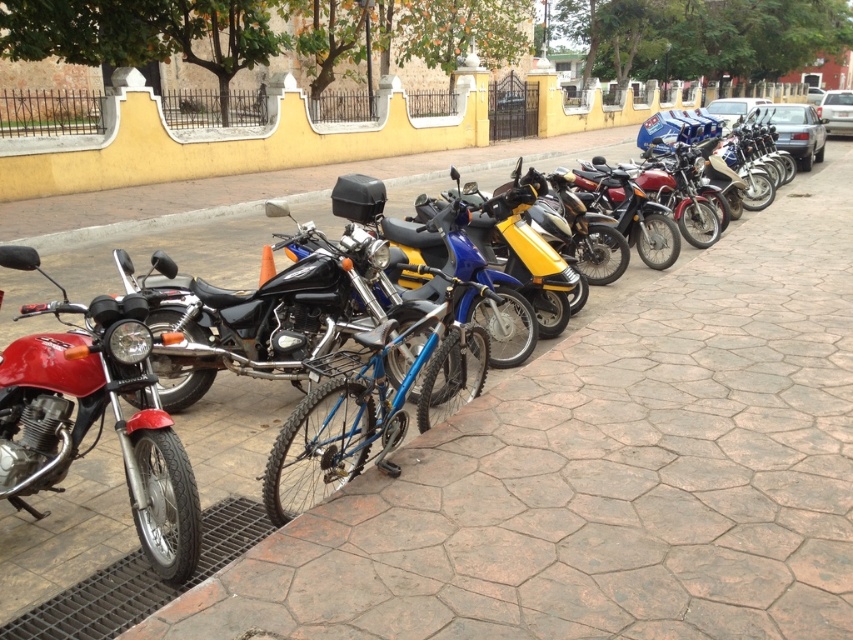
Does shiny red motorcycle at left have a smaller size compared to blue metallic bicycle at center?

Correct, shiny red motorcycle at left occupies less space than blue metallic bicycle at center.

Which is above, shiny red motorcycle at left or blue metallic bicycle at center?

Positioned higher is blue metallic bicycle at center.

What do you see at coordinates (96, 419) in the screenshot?
I see `shiny red motorcycle at left` at bounding box center [96, 419].

Locate an element on the screen. shiny red motorcycle at left is located at coordinates (96, 419).